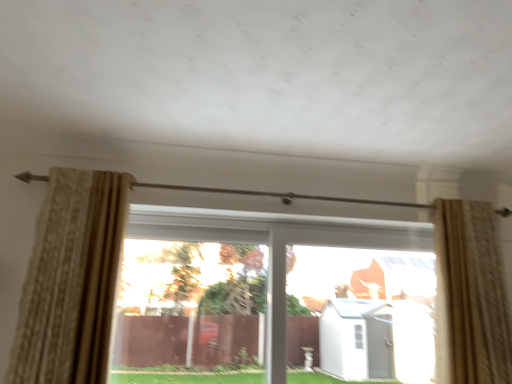
Identify the location of transparent glass window at center, the 2th window in the left-to-right sequence. This screenshot has width=512, height=384. (286, 290).

Image resolution: width=512 pixels, height=384 pixels. I want to click on beige textured curtain at right, the 2th curtain when ordered from left to right, so click(x=470, y=295).

The image size is (512, 384). What do you see at coordinates (186, 295) in the screenshot?
I see `transparent glass window at center, which is the 2th window from right to left` at bounding box center [186, 295].

Find the location of `beige textured curtain at left, the second curtain viewed from the right`. beige textured curtain at left, the second curtain viewed from the right is located at coordinates (72, 280).

Which of these two, transparent glass window at center, which is the 2th window from right to left, or beige textured curtain at left, the second curtain viewed from the right, stands shorter?

With less height is transparent glass window at center, which is the 2th window from right to left.

Is transparent glass window at center, which is the 2th window from right to left, positioned far away from beige textured curtain at left, the second curtain viewed from the right?

No.

How different are the orientations of transparent glass window at center, the 1th window positioned from the left, and beige textured curtain at left, the second curtain viewed from the right, in degrees?

There is a 1.98-degree angle between the facing directions of transparent glass window at center, the 1th window positioned from the left, and beige textured curtain at left, the second curtain viewed from the right.

Is transparent glass window at center, which is the 2th window from right to left, not within beige textured curtain at left, the second curtain viewed from the right?

Absolutely, transparent glass window at center, which is the 2th window from right to left, is external to beige textured curtain at left, the second curtain viewed from the right.

Which is more to the right, beige textured curtain at right, the 2th curtain when ordered from left to right, or beige textured curtain at left, the second curtain viewed from the right?

Positioned to the right is beige textured curtain at right, the 2th curtain when ordered from left to right.

Can we say beige textured curtain at right, the 1th curtain in the right-to-left sequence, lies outside beige textured curtain at left, the second curtain viewed from the right?

Yes, beige textured curtain at right, the 1th curtain in the right-to-left sequence, is not within beige textured curtain at left, the second curtain viewed from the right.

Who is taller, beige textured curtain at right, the 2th curtain when ordered from left to right, or beige textured curtain at left, the first curtain viewed from the left?

Standing taller between the two is beige textured curtain at right, the 2th curtain when ordered from left to right.

Can you tell me how much beige textured curtain at right, the 2th curtain when ordered from left to right, and beige textured curtain at left, the second curtain viewed from the right, differ in facing direction?

beige textured curtain at right, the 2th curtain when ordered from left to right, and beige textured curtain at left, the second curtain viewed from the right, are facing 3.63 degrees away from each other.

In the scene shown: From the image's perspective, which is below, transparent glass window at center, which is the 2th window from right to left, or transparent glass window at center, the first window when ordered from right to left?

transparent glass window at center, the first window when ordered from right to left, from the image's perspective.

Is transparent glass window at center, the 1th window positioned from the left, aimed at transparent glass window at center, the first window when ordered from right to left?

Yes, transparent glass window at center, the 1th window positioned from the left, is oriented towards transparent glass window at center, the first window when ordered from right to left.

In the scene shown: From a real-world perspective, which object stands above the other?

In real-world perspective, transparent glass window at center, the 1th window positioned from the left, is above.

I want to click on window on the right side of transparent glass window at center, the 1th window positioned from the left, so click(x=286, y=290).

From a real-world perspective, is transparent glass window at center, the first window when ordered from right to left, beneath transparent glass window at center, which is the 2th window from right to left?

Correct, in the physical world, transparent glass window at center, the first window when ordered from right to left, is lower than transparent glass window at center, which is the 2th window from right to left.

Who is smaller, transparent glass window at center, the 2th window in the left-to-right sequence, or transparent glass window at center, the 1th window positioned from the left?

Smaller between the two is transparent glass window at center, the 1th window positioned from the left.

Consider the image. In terms of height, does transparent glass window at center, the 2th window in the left-to-right sequence, look taller or shorter compared to transparent glass window at center, the 1th window positioned from the left?

Clearly, transparent glass window at center, the 2th window in the left-to-right sequence, is shorter compared to transparent glass window at center, the 1th window positioned from the left.

In the scene shown: Is beige textured curtain at left, the second curtain viewed from the right, positioned far away from transparent glass window at center, the first window when ordered from right to left?

No.

From a real-world perspective, between beige textured curtain at left, the second curtain viewed from the right, and transparent glass window at center, the first window when ordered from right to left, who is vertically higher?

beige textured curtain at left, the second curtain viewed from the right.

Considering the positions of objects beige textured curtain at left, the second curtain viewed from the right, and transparent glass window at center, the first window when ordered from right to left, in the image provided, who is more to the left, beige textured curtain at left, the second curtain viewed from the right, or transparent glass window at center, the first window when ordered from right to left,?

beige textured curtain at left, the second curtain viewed from the right, is more to the left.

Where is `curtain that appears on the right of transparent glass window at center, the first window when ordered from right to left`? This screenshot has width=512, height=384. curtain that appears on the right of transparent glass window at center, the first window when ordered from right to left is located at coordinates (470, 295).

Can transparent glass window at center, the first window when ordered from right to left, be found inside beige textured curtain at right, the 2th curtain when ordered from left to right?

Definitely not — transparent glass window at center, the first window when ordered from right to left, is not inside beige textured curtain at right, the 2th curtain when ordered from left to right.

Consider the image. Is beige textured curtain at right, the 1th curtain in the right-to-left sequence, behind transparent glass window at center, the first window when ordered from right to left?

No, the depth of beige textured curtain at right, the 1th curtain in the right-to-left sequence, is less than that of transparent glass window at center, the first window when ordered from right to left.

Does point (455, 209) lie behind point (168, 325)?

Yes.

Is beige textured curtain at right, the 1th curtain in the right-to-left sequence, completely or partially inside beige textured curtain at left, the second curtain viewed from the right?

No, beige textured curtain at right, the 1th curtain in the right-to-left sequence, is located outside of beige textured curtain at left, the second curtain viewed from the right.

Which is farther from the camera, [55,265] or [500,365]?

The point [500,365] is more distant.

Based on the photo, how much distance is there between beige textured curtain at left, the second curtain viewed from the right, and beige textured curtain at right, the 2th curtain when ordered from left to right?

The distance of beige textured curtain at left, the second curtain viewed from the right, from beige textured curtain at right, the 2th curtain when ordered from left to right, is 5.97 feet.

From the image's perspective, between beige textured curtain at left, the first curtain viewed from the left, and beige textured curtain at right, the 2th curtain when ordered from left to right, who is located below?

beige textured curtain at right, the 2th curtain when ordered from left to right, from the image's perspective.

Where is `the 2nd curtain in front of the transparent glass window at center, which is the 2th window from right to left, starting your count from the anchor`? Image resolution: width=512 pixels, height=384 pixels. the 2nd curtain in front of the transparent glass window at center, which is the 2th window from right to left, starting your count from the anchor is located at coordinates (72, 280).

The height and width of the screenshot is (384, 512). Identify the location of curtain lying below the beige textured curtain at left, the first curtain viewed from the left (from the image's perspective). (470, 295).

Based on their spatial positions, is beige textured curtain at left, the first curtain viewed from the left, or transparent glass window at center, the 1th window positioned from the left, further from beige textured curtain at right, the 1th curtain in the right-to-left sequence?

The object further to beige textured curtain at right, the 1th curtain in the right-to-left sequence, is beige textured curtain at left, the first curtain viewed from the left.

Looking at the image, which one is located closer to beige textured curtain at right, the 2th curtain when ordered from left to right, transparent glass window at center, the 1th window positioned from the left, or beige textured curtain at left, the second curtain viewed from the right?

transparent glass window at center, the 1th window positioned from the left, is closer to beige textured curtain at right, the 2th curtain when ordered from left to right.

Based on their spatial positions, is beige textured curtain at right, the 1th curtain in the right-to-left sequence, or beige textured curtain at left, the second curtain viewed from the right, further from transparent glass window at center, which is the 2th window from right to left?

The object further to transparent glass window at center, which is the 2th window from right to left, is beige textured curtain at right, the 1th curtain in the right-to-left sequence.

Estimate the real-world distances between objects in this image. Which object is further from beige textured curtain at left, the second curtain viewed from the right, transparent glass window at center, the 1th window positioned from the left, or beige textured curtain at right, the 1th curtain in the right-to-left sequence?

Among the two, beige textured curtain at right, the 1th curtain in the right-to-left sequence, is located further to beige textured curtain at left, the second curtain viewed from the right.

From the image, which object appears to be farther from transparent glass window at center, the 1th window positioned from the left, beige textured curtain at left, the second curtain viewed from the right, or transparent glass window at center, the 2th window in the left-to-right sequence?

Among the two, beige textured curtain at left, the second curtain viewed from the right, is located further to transparent glass window at center, the 1th window positioned from the left.

Which object lies further to the anchor point beige textured curtain at left, the first curtain viewed from the left, transparent glass window at center, the first window when ordered from right to left, or transparent glass window at center, which is the 2th window from right to left?

transparent glass window at center, the first window when ordered from right to left, lies further to beige textured curtain at left, the first curtain viewed from the left, than the other object.

Which object lies further to the anchor point transparent glass window at center, the 1th window positioned from the left, beige textured curtain at left, the first curtain viewed from the left, or beige textured curtain at right, the 2th curtain when ordered from left to right?

beige textured curtain at right, the 2th curtain when ordered from left to right.

When comparing their distances from beige textured curtain at right, the 1th curtain in the right-to-left sequence, does transparent glass window at center, the first window when ordered from right to left, or beige textured curtain at left, the first curtain viewed from the left, seem closer?

transparent glass window at center, the first window when ordered from right to left, is closer to beige textured curtain at right, the 1th curtain in the right-to-left sequence.

Locate an element on the screen. The width and height of the screenshot is (512, 384). window between transparent glass window at center, which is the 2th window from right to left, and beige textured curtain at right, the 2th curtain when ordered from left to right is located at coordinates (286, 290).

This screenshot has height=384, width=512. I want to click on window located between beige textured curtain at left, the second curtain viewed from the right, and transparent glass window at center, the 2th window in the left-to-right sequence, in the left-right direction, so click(x=186, y=295).